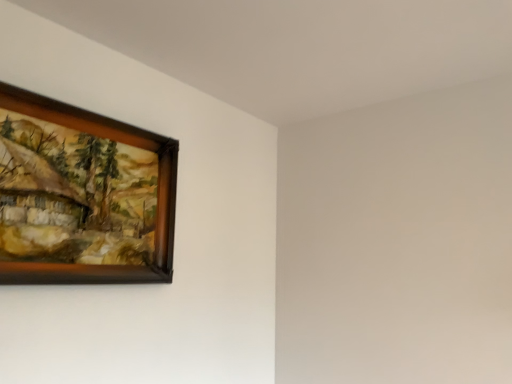
This screenshot has width=512, height=384. What do you see at coordinates (82, 196) in the screenshot?
I see `wooden picture frame at upper left` at bounding box center [82, 196].

Where is `wooden picture frame at upper left`? wooden picture frame at upper left is located at coordinates (82, 196).

The image size is (512, 384). Find the location of `wooden picture frame at upper left`. wooden picture frame at upper left is located at coordinates (82, 196).